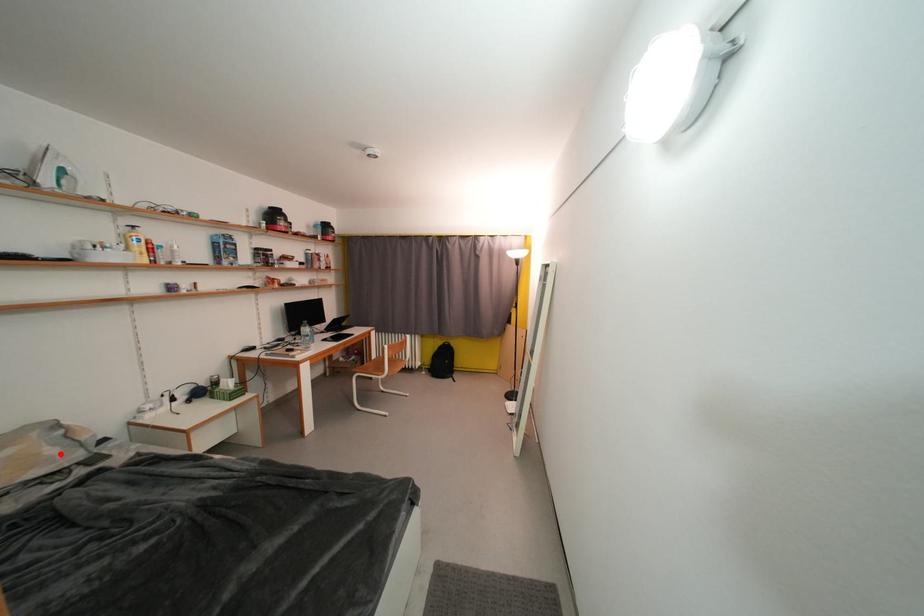
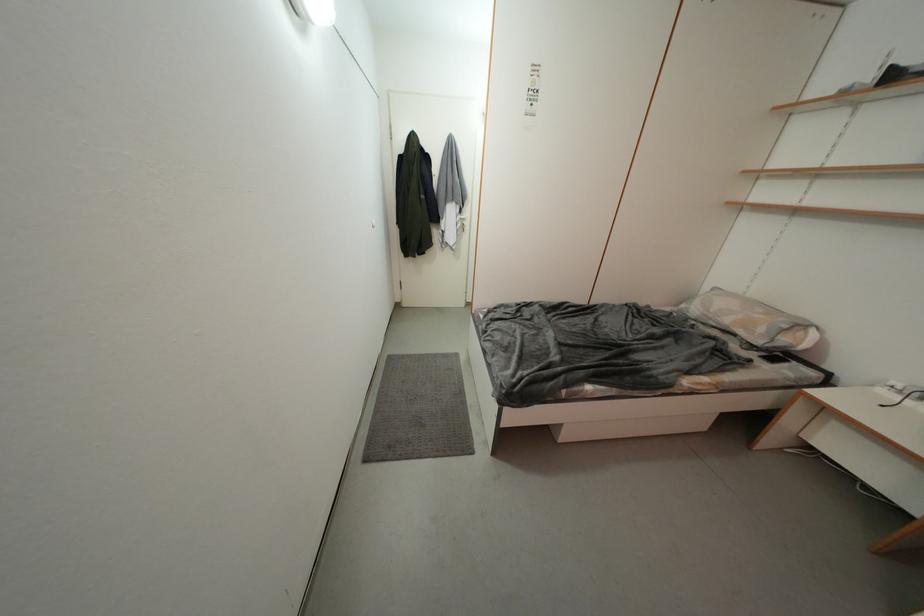
Where in the second image is the point corresponding to the highlighted location from the first image?

(769, 333)